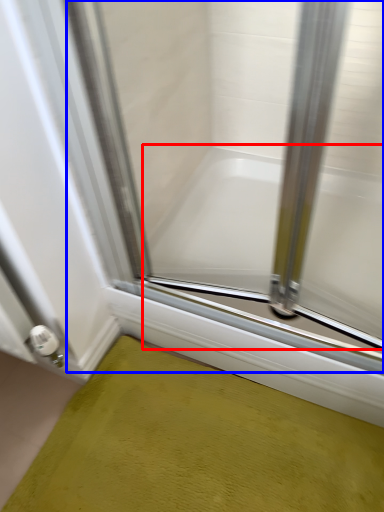
Question: Among these objects, which one is farthest to the camera, bathtub (highlighted by a red box) or glass door (highlighted by a blue box)?

Choices:
 (A) bathtub
 (B) glass door

Answer: (A)